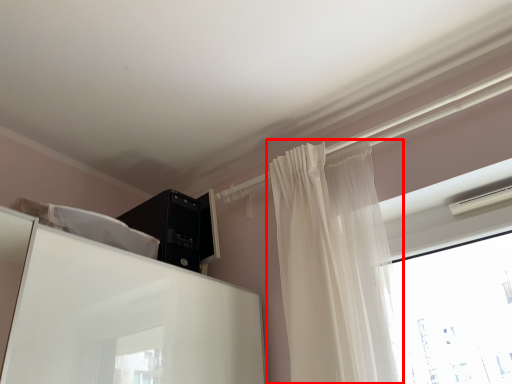
Question: In this image, where is curtain (annotated by the red box) located relative to appliance?

Choices:
 (A) left
 (B) right

Answer: (B)